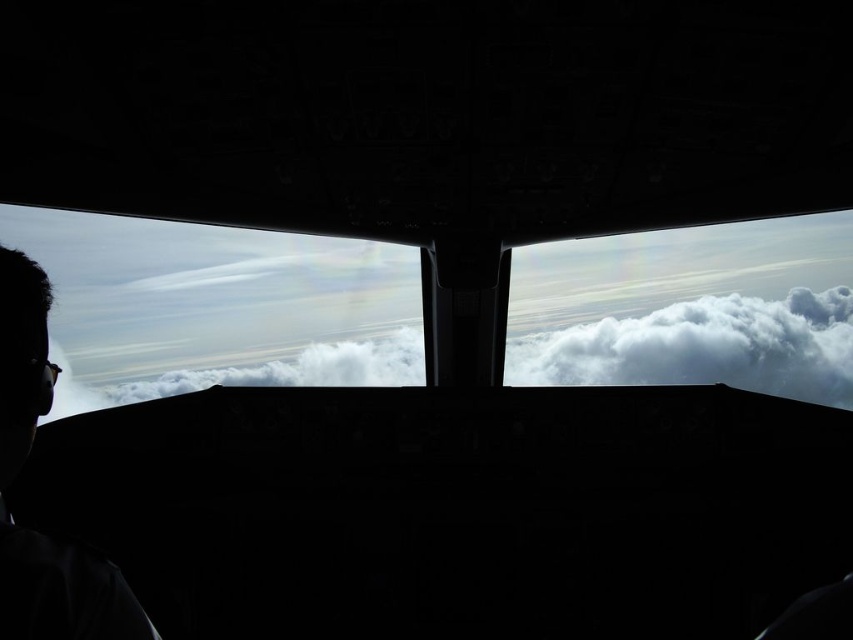
Question: Based on their relative distances, which object is farther from the silhouette head at left?

Choices:
 (A) transparent glass airplane window at center
 (B) white fluffy cloud at center

Answer: (B)

Question: Does transparent glass airplane window at center have a smaller size compared to white fluffy cloud at center?

Choices:
 (A) no
 (B) yes

Answer: (A)

Question: Is transparent glass airplane window at center bigger than white fluffy cloud at center?

Choices:
 (A) yes
 (B) no

Answer: (A)

Question: Which point appears farthest from the camera in this image?

Choices:
 (A) (67, 618)
 (B) (796, 320)
 (C) (576, 362)

Answer: (B)

Question: Which of these objects is positioned closest to the transparent glass airplane window at center?

Choices:
 (A) white fluffy cloud at center
 (B) silhouette head at left

Answer: (A)

Question: Does transparent glass airplane window at center have a greater width compared to silhouette head at left?

Choices:
 (A) no
 (B) yes

Answer: (B)